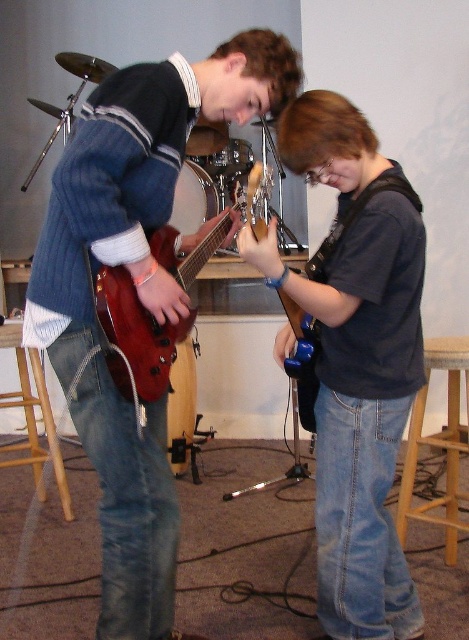
Which is in front, point (169, 355) or point (311, 387)?

Positioned in front is point (169, 355).

Which is below, glossy wood guitar at center or glossy plastic guitar at center?

Positioned lower is glossy plastic guitar at center.

Is point (134, 317) closer to viewer compared to point (310, 269)?

Yes, it is.

Find the location of a particular element. The image size is (469, 640). glossy wood guitar at center is located at coordinates (136, 337).

Is matte black guitar at center smaller than glossy wood guitar at center?

Incorrect, matte black guitar at center is not smaller in size than glossy wood guitar at center.

What do you see at coordinates (137, 180) in the screenshot? This screenshot has width=469, height=640. I see `matte black guitar at center` at bounding box center [137, 180].

At what (x,y) coordinates should I click in order to perform the action: click on matte black guitar at center. Please return your answer as a coordinate pair (x, y). This screenshot has height=640, width=469. Looking at the image, I should click on (137, 180).

In the scene shown: Is blue glossy guitar at center taller than glossy plastic guitar at center?

Correct, blue glossy guitar at center is much taller as glossy plastic guitar at center.

Where is `blue glossy guitar at center`? blue glossy guitar at center is located at coordinates (361, 408).